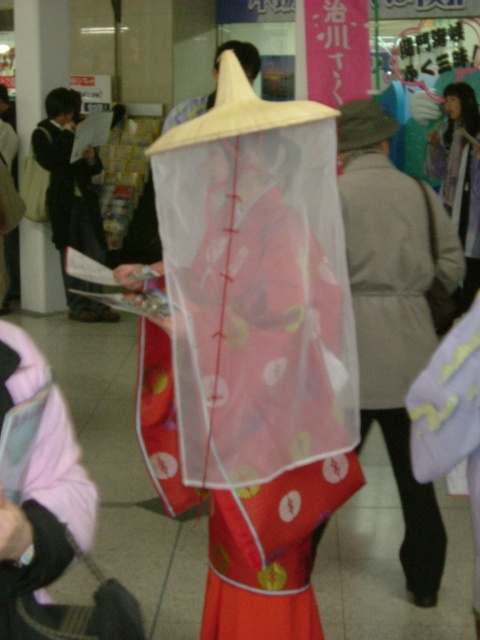
Does matte red kimono at center have a lesser height compared to matte pink kimono at center?

Correct, matte red kimono at center is not as tall as matte pink kimono at center.

Does point (200, 326) come farther from viewer compared to point (466, 161)?

No, (200, 326) is in front of (466, 161).

At what (x,y) coordinates should I click in order to perform the action: click on matte red kimono at center. Please return your answer as a coordinate pair (x, y). Looking at the image, I should click on (259, 346).

Who is positioned more to the left, matte black jacket at left or matte pink kimono at center?

From the viewer's perspective, matte black jacket at left appears more on the left side.

Is matte black jacket at left further to camera compared to matte pink kimono at center?

Yes, it is behind matte pink kimono at center.

What do you see at coordinates (71, 195) in the screenshot? I see `matte black jacket at left` at bounding box center [71, 195].

The image size is (480, 640). What are the coordinates of `matte black jacket at left` in the screenshot? It's located at (71, 195).

Does matte red kimono at center have a lesser height compared to matte black jacket at left?

Yes, matte red kimono at center is shorter than matte black jacket at left.

Is matte red kimono at center wider than matte black jacket at left?

Indeed, matte red kimono at center has a greater width compared to matte black jacket at left.

Describe the element at coordinates (259, 346) in the screenshot. I see `matte red kimono at center` at that location.

Where is `matte red kimono at center`? Image resolution: width=480 pixels, height=640 pixels. matte red kimono at center is located at coordinates (259, 346).